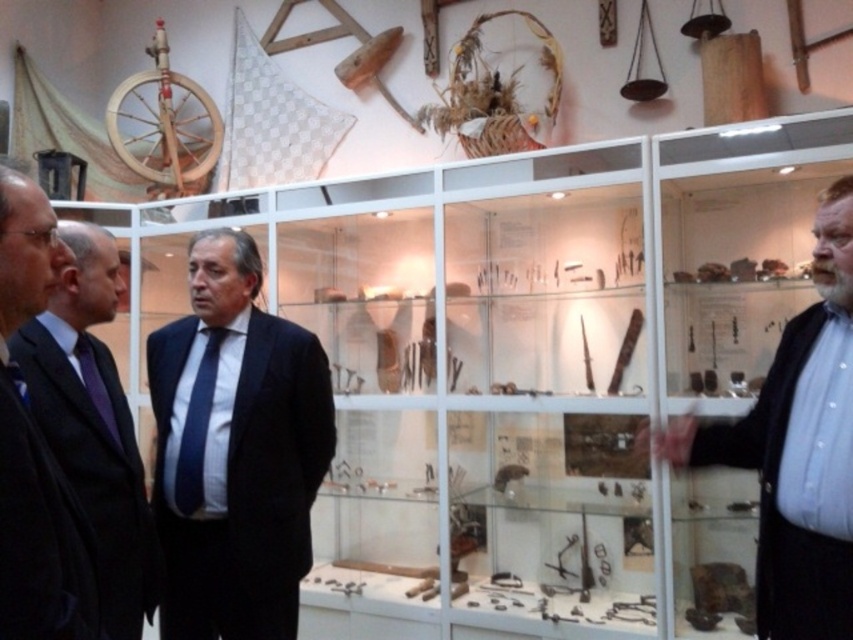
Is point (111, 445) closer to camera compared to point (96, 364)?

That is True.

Based on the photo, between black suit at left and purple satin tie at left, which one has more height?

Standing taller between the two is black suit at left.

Where is `black suit at left`? The height and width of the screenshot is (640, 853). black suit at left is located at coordinates (94, 422).

Looking at this image, is black wool suit at left wider than blue striped tie at center?

Yes.

Does black wool suit at left have a lesser width compared to blue striped tie at center?

No, black wool suit at left is not thinner than blue striped tie at center.

Between point (33, 536) and point (219, 333), which one is positioned in front?

Point (33, 536) is in front.

Identify the location of black wool suit at left. Image resolution: width=853 pixels, height=640 pixels. (39, 536).

Is point (120, 602) positioned behind point (30, 476)?

Yes.

Can you confirm if black suit at left is positioned to the left of black wool suit at left?

Indeed, black suit at left is positioned on the left side of black wool suit at left.

Identify the location of black suit at left. (94, 422).